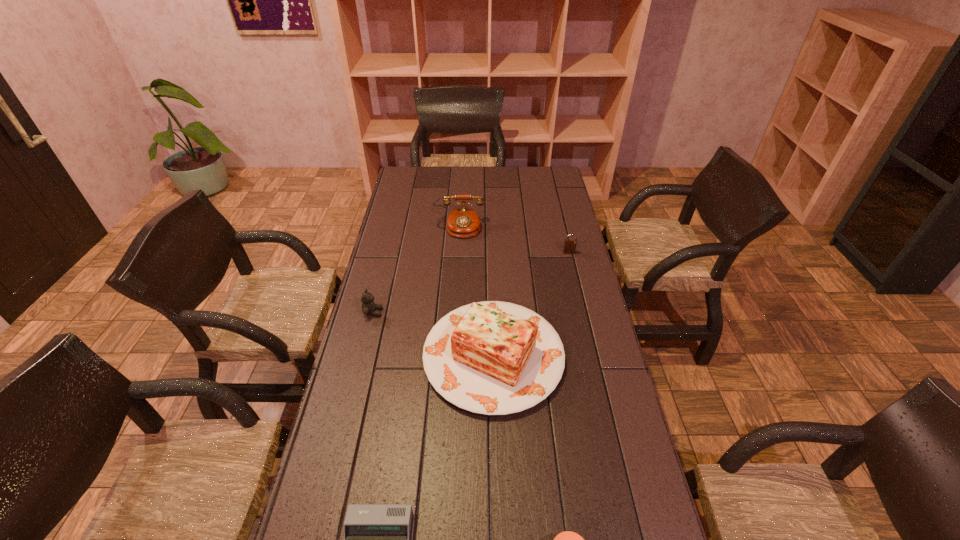
Locate an element on the screen. Image resolution: width=960 pixels, height=540 pixels. telephone is located at coordinates (463, 222).

Locate an element on the screen. lasagna is located at coordinates (494, 358).

Where is `the leftmost object`? This screenshot has width=960, height=540. the leftmost object is located at coordinates click(369, 307).

Where is `the rightmost object`? The image size is (960, 540). the rightmost object is located at coordinates (569, 246).

The image size is (960, 540). Identify the location of the fifth nearest object. (569, 246).

I want to click on free space located 0.220m on the dial of the farthest object, so click(456, 274).

Identify the location of vacant point located on the left of the lasagna. The height and width of the screenshot is (540, 960). (398, 356).

Locate an element on the screen. The width and height of the screenshot is (960, 540). free space located 0.310m on the face of the teddy bear is located at coordinates (472, 312).

I want to click on vacant space situated on the front-facing side of the rightmost object, so click(x=582, y=306).

Find the location of a particular element. object present at the left edge is located at coordinates (369, 307).